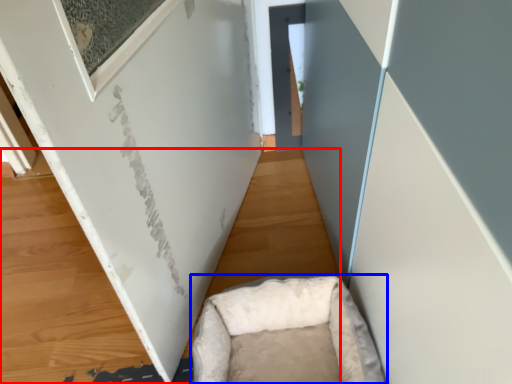
Question: Which point is further to the camera, plywood (highlighted by a red box) or furniture (highlighted by a blue box)?

Choices:
 (A) plywood
 (B) furniture

Answer: (A)